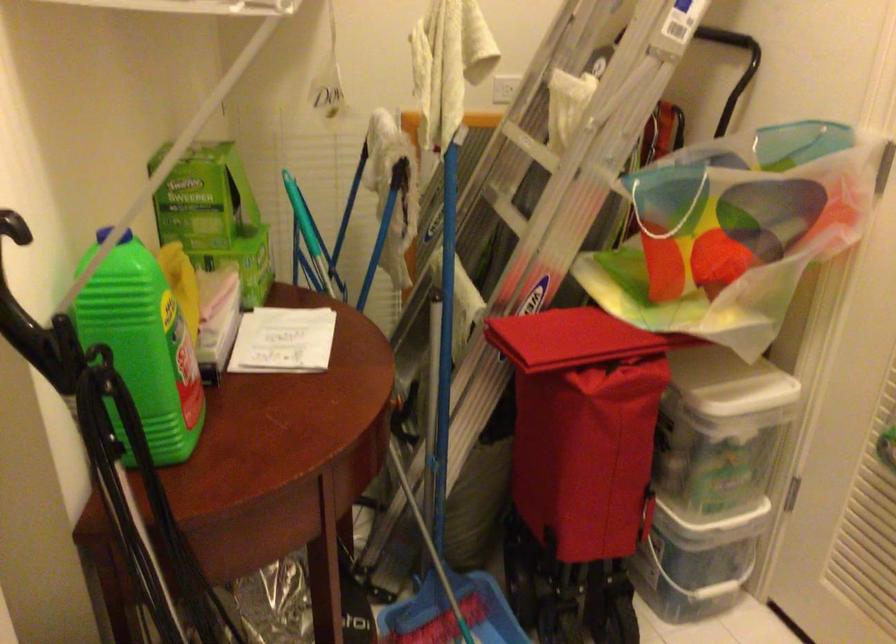
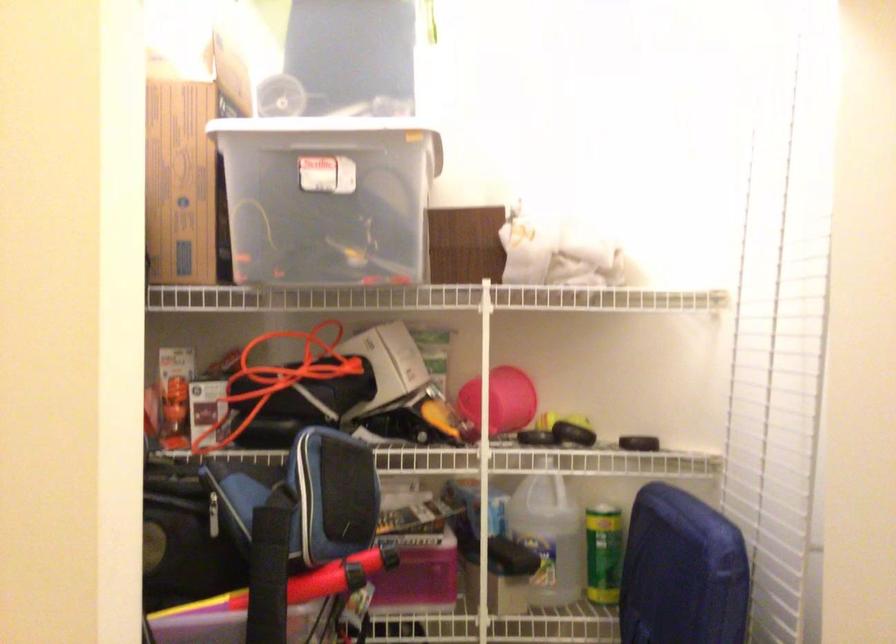
Question: The first image is from the beginning of the video and the second image is from the end. How did the camera likely rotate when shooting the video?

Choices:
 (A) Left
 (B) Right
 (C) Up
 (D) Down

Answer: (A)